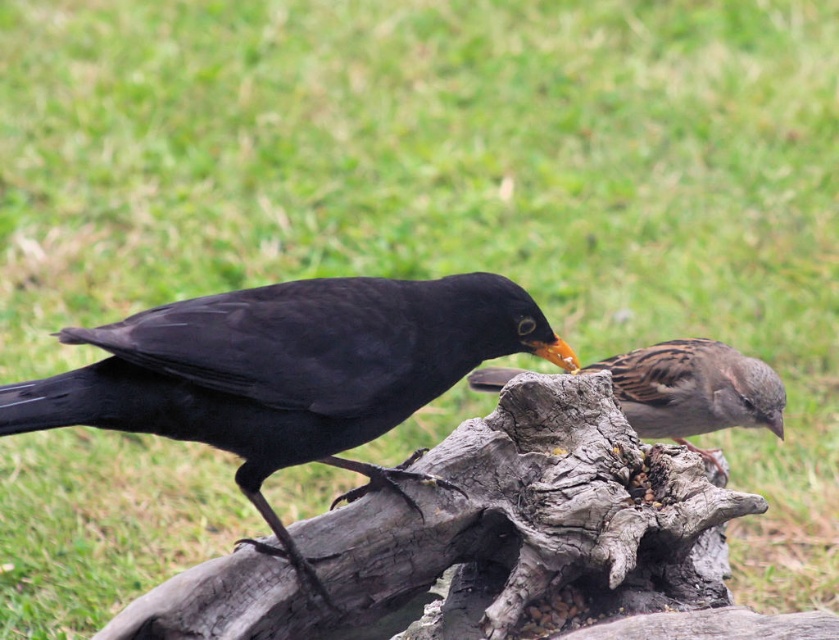
Question: Does brown speckled sparrow at right have a lesser width compared to brown speckled feathers at center?

Choices:
 (A) no
 (B) yes

Answer: (A)

Question: Does brown speckled sparrow at right have a smaller size compared to brown speckled feathers at center?

Choices:
 (A) yes
 (B) no

Answer: (B)

Question: Which of the following is the closest to the observer?

Choices:
 (A) (415, 308)
 (B) (761, 385)

Answer: (A)

Question: Which of the following is the closest to the observer?

Choices:
 (A) brown speckled feathers at center
 (B) brown speckled sparrow at right

Answer: (B)

Question: Does brown speckled sparrow at right appear over brown speckled feathers at center?

Choices:
 (A) no
 (B) yes

Answer: (B)